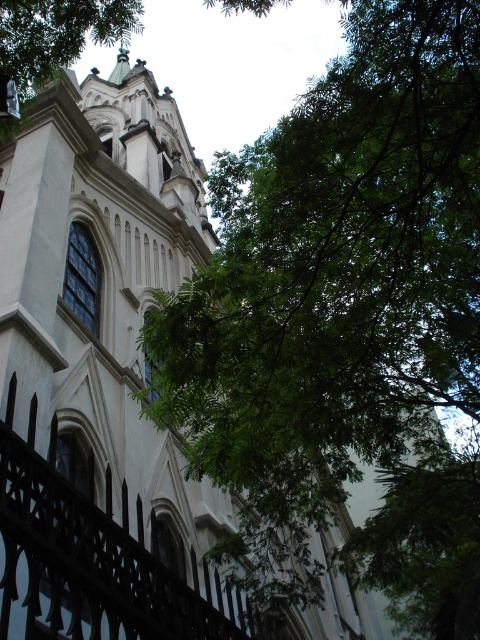
You are standing in front of the grand historic building and want to take a photo of the green leafy tree at upper right without including the black wrought iron fence at lower left. Is the tree positioned in a way that allows this?

The green leafy tree at upper right is above the black wrought iron fence at lower left, so yes, you can take a photo of the green leafy tree at upper right without including the black wrought iron fence at lower left by angling the camera upwards to focus on the upper part of the scene.